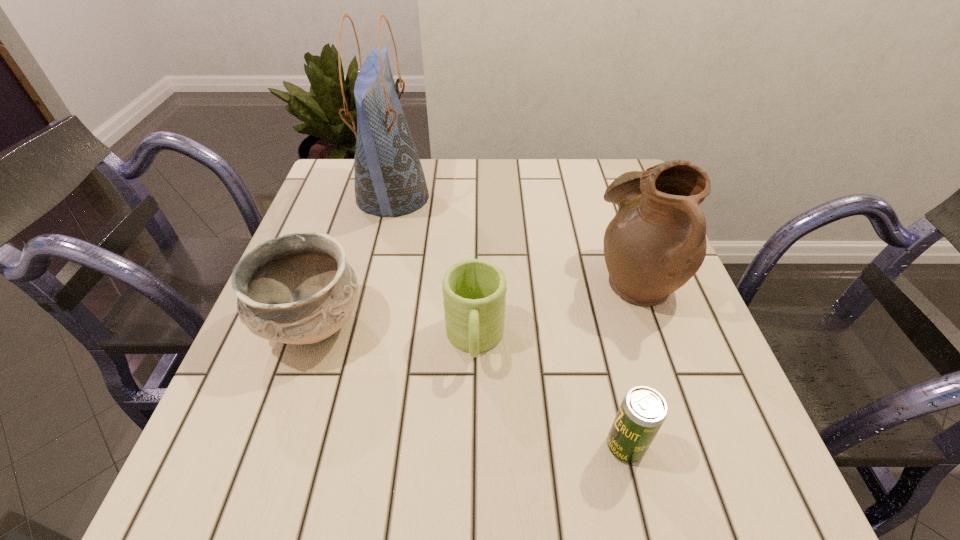
Identify the location of the farthest object. The height and width of the screenshot is (540, 960). (389, 180).

Find the location of `shopping bag`. shopping bag is located at coordinates (389, 180).

At what (x,y) coordinates should I click in order to perform the action: click on the second tallest object. Please return your answer as a coordinate pair (x, y). Image resolution: width=960 pixels, height=540 pixels. Looking at the image, I should click on (656, 242).

At what (x,y) coordinates should I click in order to perform the action: click on pottery. Please return your answer as a coordinate pair (x, y). The image size is (960, 540). Looking at the image, I should click on (298, 288).

Find the location of `the third object from left to right`. the third object from left to right is located at coordinates (474, 291).

Locate an element on the screen. the nearest object is located at coordinates (643, 410).

The image size is (960, 540). What are the coordinates of `free space located 0.230m on the front of the shopping bag` in the screenshot? It's located at (367, 303).

The height and width of the screenshot is (540, 960). I want to click on free location located 0.130m at the spout of the pitcher, so click(533, 279).

Find the location of a particular element. This screenshot has width=960, height=540. blank area located at the spout of the pitcher is located at coordinates (515, 279).

Where is `vacant space located at the spout of the pitcher`? This screenshot has width=960, height=540. vacant space located at the spout of the pitcher is located at coordinates (413, 279).